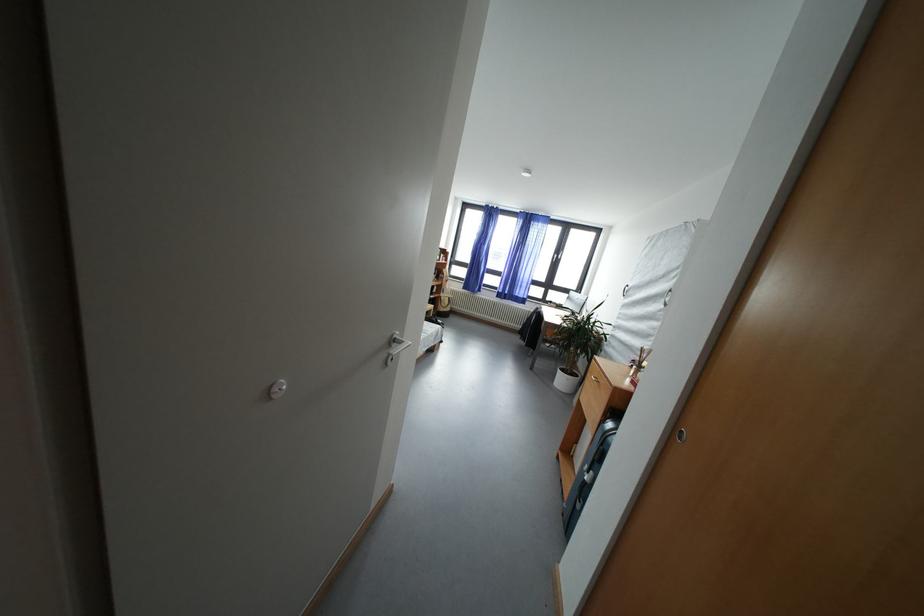
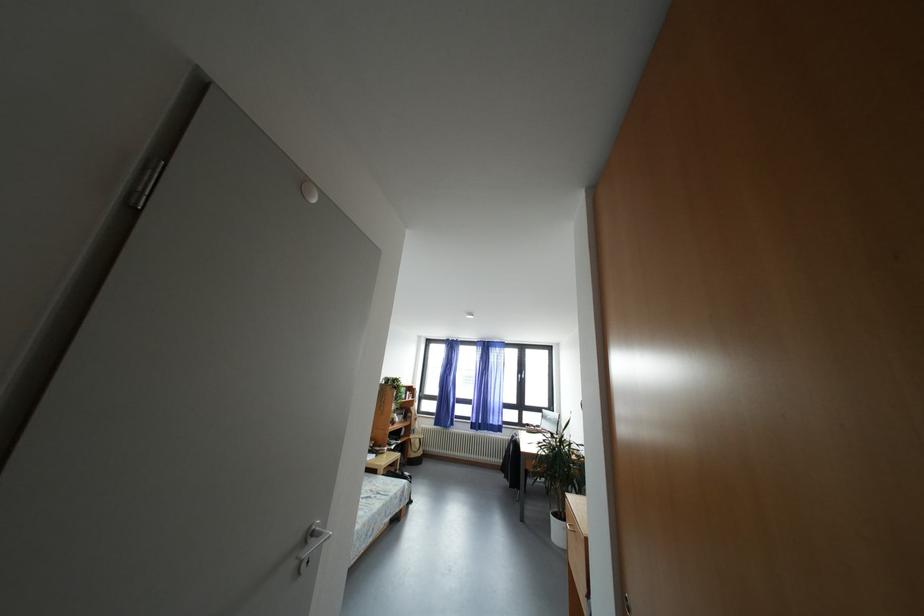
The point at (505, 305) is marked in the first image. Where is the corresponding point in the second image?

(480, 437)